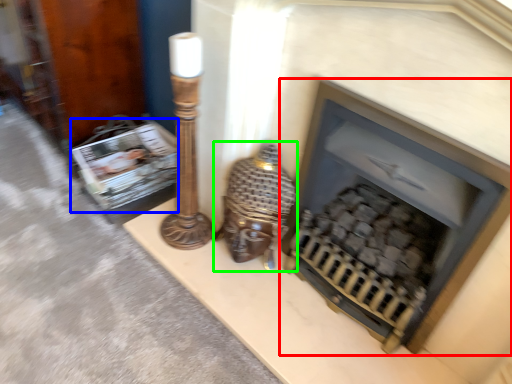
Question: Which object is the farthest from fireplace (highlighted by a red box)? Choose among these: magazine (highlighted by a blue box) or table lamp (highlighted by a green box).

Choices:
 (A) magazine
 (B) table lamp

Answer: (A)